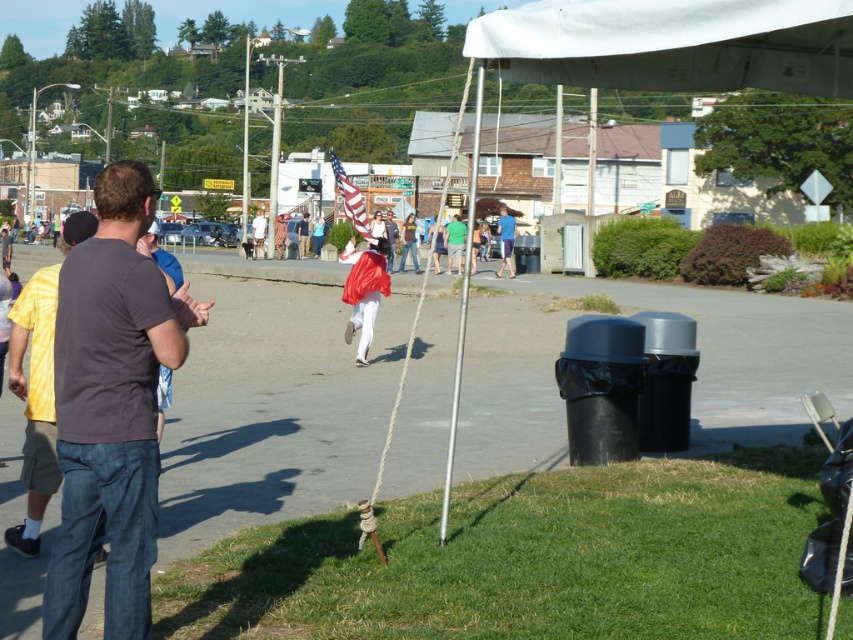
Question: Does light brown wooden sign at center appear on the right side of blue denim jeans at center?

Choices:
 (A) yes
 (B) no

Answer: (B)

Question: Does dark gray t-shirt at left lie in front of blue denim jeans at center?

Choices:
 (A) no
 (B) yes

Answer: (B)

Question: Among these points, which one is nearest to the camera?

Choices:
 (A) (393, 250)
 (B) (608, 10)
 (C) (299, 250)

Answer: (B)

Question: Which object appears farthest from the camera in this image?

Choices:
 (A) white fabric canopy at upper center
 (B) red flag at center
 (C) blue denim jeans at center
 (D) light brown wooden sign at center

Answer: (C)

Question: Which object is positioned closest to the white fabric canopy at upper center?

Choices:
 (A) light brown wooden sign at center
 (B) red flag at center
 (C) blue denim jeans at center
 (D) dark gray t-shirt at left

Answer: (D)

Question: Is shiny red fabric at center wider than blue denim jeans at center?

Choices:
 (A) no
 (B) yes

Answer: (B)